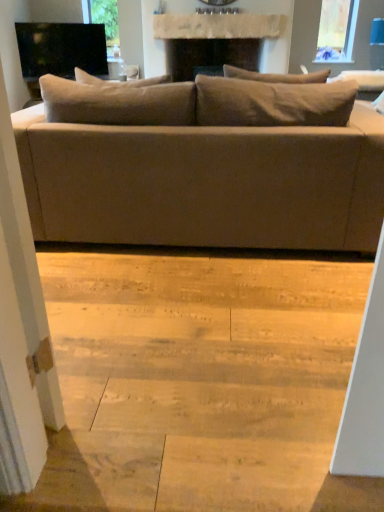
Question: Considering the relative sizes of natural wood stair at lower center and matte beige couch at center in the image provided, is natural wood stair at lower center taller than matte beige couch at center?

Choices:
 (A) yes
 (B) no

Answer: (B)

Question: From the image's perspective, is natural wood stair at lower center located beneath matte beige couch at center?

Choices:
 (A) yes
 (B) no

Answer: (A)

Question: Is natural wood stair at lower center to the left of matte beige couch at center from the viewer's perspective?

Choices:
 (A) no
 (B) yes

Answer: (B)

Question: Does natural wood stair at lower center lie behind matte beige couch at center?

Choices:
 (A) yes
 (B) no

Answer: (B)

Question: Is natural wood stair at lower center oriented towards matte beige couch at center?

Choices:
 (A) no
 (B) yes

Answer: (A)

Question: From a real-world perspective, is natural wood stair at lower center over matte beige couch at center?

Choices:
 (A) no
 (B) yes

Answer: (A)

Question: Is matte beige couch at center turned away from natural wood stair at lower center?

Choices:
 (A) yes
 (B) no

Answer: (B)

Question: Can you confirm if matte beige couch at center is thinner than natural wood stair at lower center?

Choices:
 (A) no
 (B) yes

Answer: (A)

Question: Considering the relative sizes of matte beige couch at center and natural wood stair at lower center in the image provided, is matte beige couch at center smaller than natural wood stair at lower center?

Choices:
 (A) no
 (B) yes

Answer: (A)

Question: Does matte beige couch at center have a lesser height compared to natural wood stair at lower center?

Choices:
 (A) no
 (B) yes

Answer: (A)

Question: Is the depth of matte beige couch at center greater than that of natural wood stair at lower center?

Choices:
 (A) yes
 (B) no

Answer: (A)

Question: From a real-world perspective, is matte beige couch at center located higher than natural wood stair at lower center?

Choices:
 (A) no
 (B) yes

Answer: (B)

Question: Is black glossy tv at upper left taller than matte beige couch at center?

Choices:
 (A) yes
 (B) no

Answer: (B)